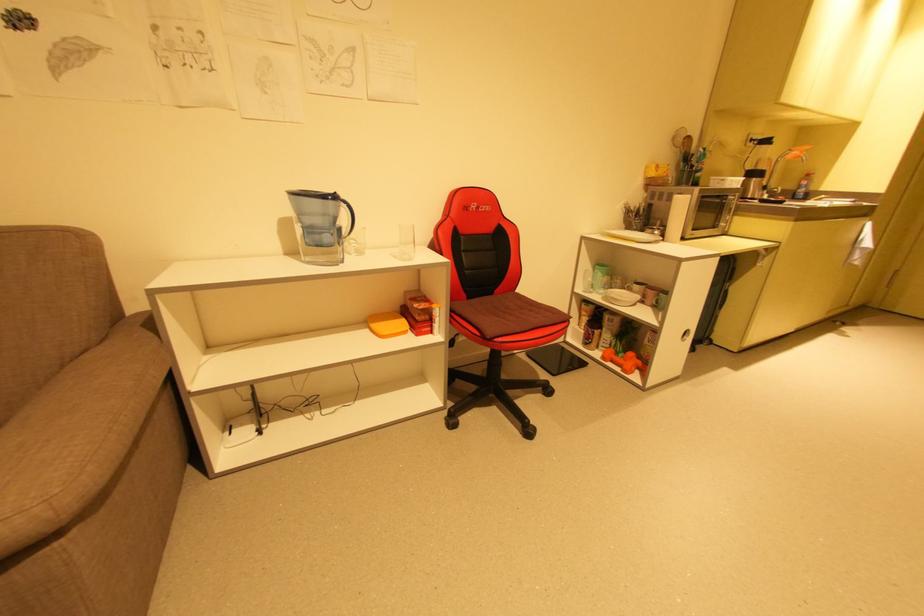
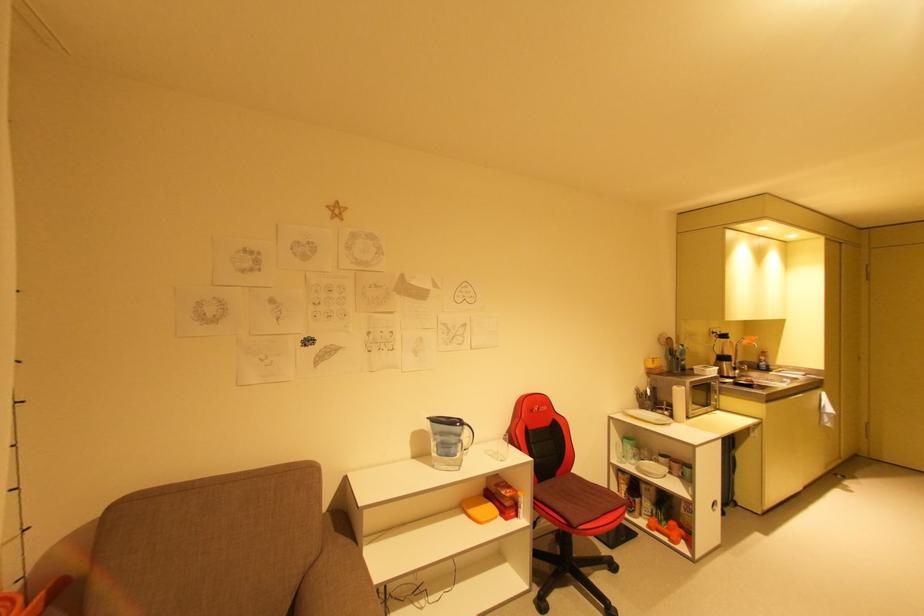
The point at (812, 203) is marked in the first image. Where is the corresponding point in the second image?

(776, 373)